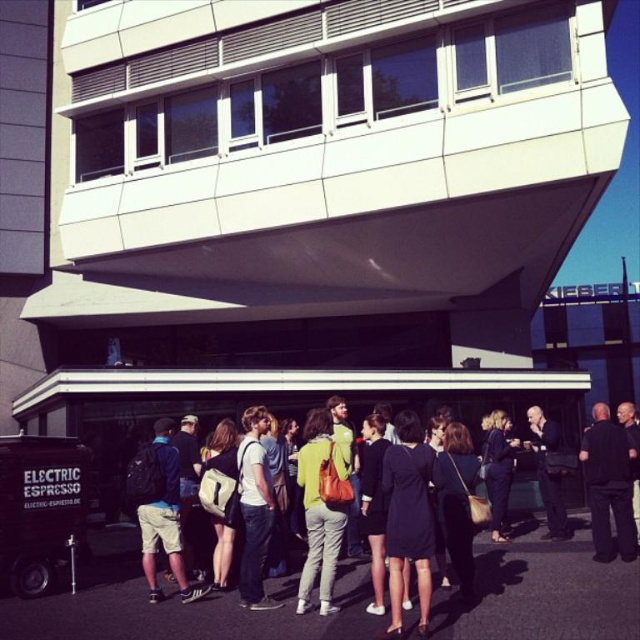
You are standing in front of the modern building with light blue denim shorts at lower left. Where exactly are the light blue denim shorts located in the scene?

The light blue denim shorts at lower left are located at point [160,509] in the scene.